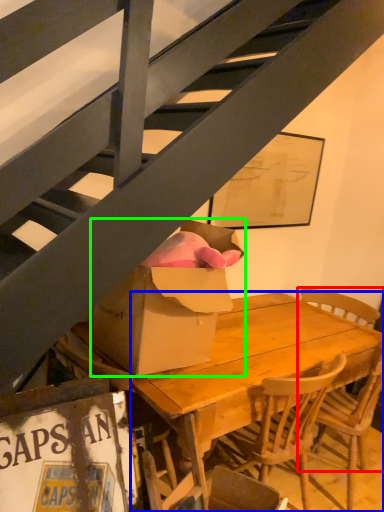
Question: Which object is positioned closest to chair (highlighted by a red box)? Select from desk (highlighted by a blue box) and box (highlighted by a green box).

Choices:
 (A) desk
 (B) box

Answer: (A)